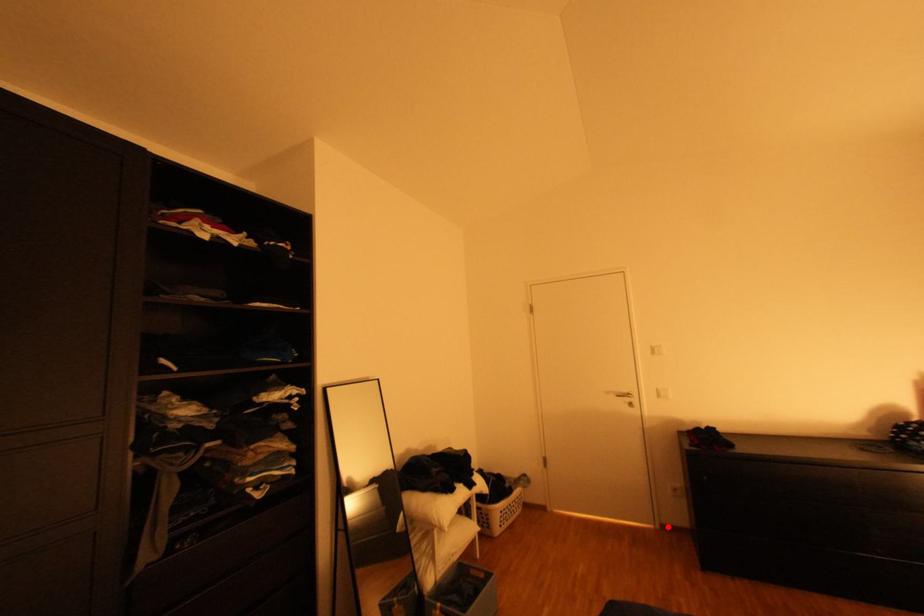
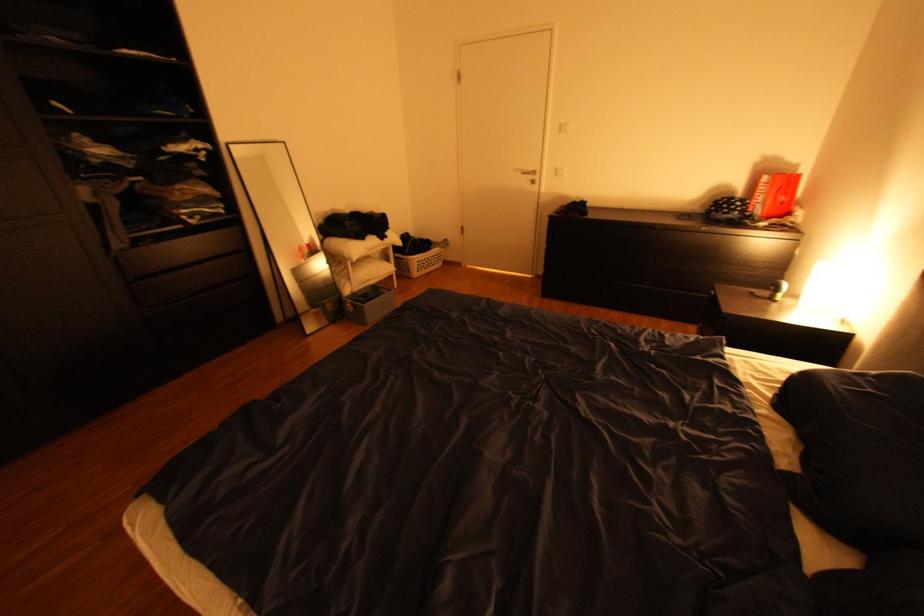
Question: I am providing you with two images of the same scene from different viewpoints. Image1 has a red point marked. In image2, the corresponding 3D location appears at what relative position? Reply with the corresponding letter.

Choices:
 (A) Closer
 (B) Farther

Answer: (A)